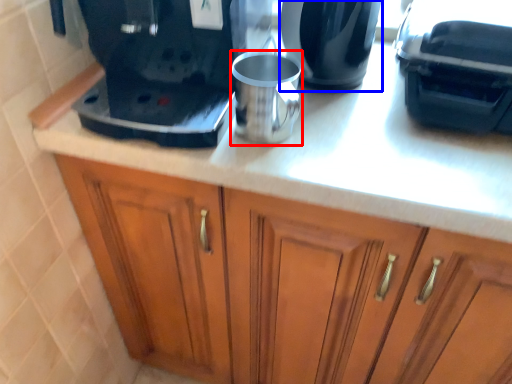
Question: Among these objects, which one is nearest to the camera, mug (highlighted by a red box) or kitchen appliance (highlighted by a blue box)?

Choices:
 (A) mug
 (B) kitchen appliance

Answer: (A)